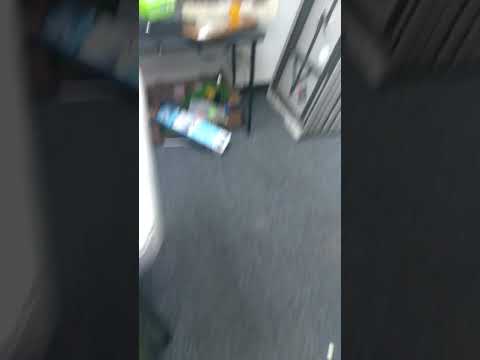
Locate an element on the screen. The width and height of the screenshot is (480, 360). table legs is located at coordinates (254, 71), (233, 69).